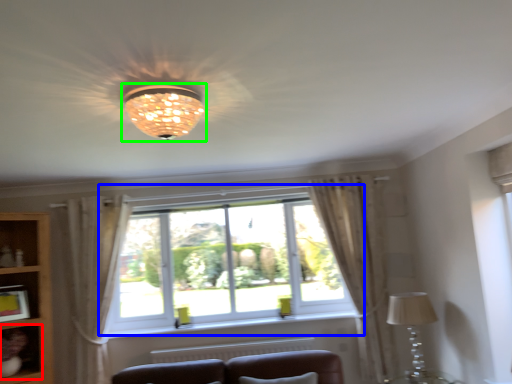
Question: Which object is positioned closest to shelf (highlighted by a red box)? Select from window (highlighted by a blue box) and lamp (highlighted by a green box).

Choices:
 (A) window
 (B) lamp

Answer: (A)